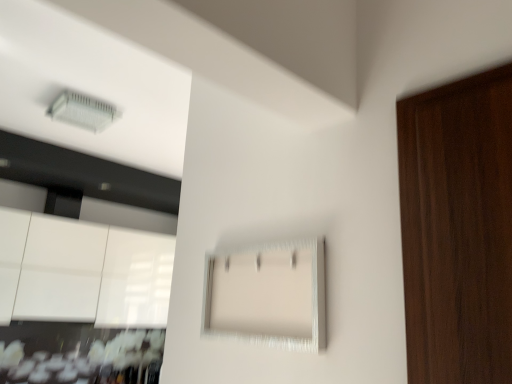
Describe the element at coordinates (268, 294) in the screenshot. I see `white textured cabinet at center, arranged as the second cabinetry when viewed from the left` at that location.

This screenshot has width=512, height=384. Identify the location of clear plastic air conditioning unit at upper left. (83, 111).

Considering the relative positions of clear plastic air conditioning unit at upper left and glossy white cabinetry at lower left, the 1th cabinetry in the left-to-right sequence, in the image provided, is clear plastic air conditioning unit at upper left to the left of glossy white cabinetry at lower left, the 1th cabinetry in the left-to-right sequence, from the viewer's perspective?

No, clear plastic air conditioning unit at upper left is not to the left of glossy white cabinetry at lower left, the 1th cabinetry in the left-to-right sequence.

I want to click on cabinetry that is behind the clear plastic air conditioning unit at upper left, so click(82, 272).

From a real-world perspective, which is physically below, clear plastic air conditioning unit at upper left or glossy white cabinetry at lower left, marked as the 2th cabinetry in a front-to-back arrangement?

In real-world perspective, glossy white cabinetry at lower left, marked as the 2th cabinetry in a front-to-back arrangement, is lower.

Considering the sizes of objects clear plastic air conditioning unit at upper left and glossy white cabinetry at lower left, marked as the 2th cabinetry in a front-to-back arrangement, in the image provided, who is taller, clear plastic air conditioning unit at upper left or glossy white cabinetry at lower left, marked as the 2th cabinetry in a front-to-back arrangement,?

glossy white cabinetry at lower left, marked as the 2th cabinetry in a front-to-back arrangement, is taller.

Who is smaller, glossy white cabinetry at lower left, the 1th cabinetry in the left-to-right sequence, or clear plastic air conditioning unit at upper left?

With smaller size is clear plastic air conditioning unit at upper left.

From a real-world perspective, which cabinetry is the 1st one underneath the clear plastic air conditioning unit at upper left? Please provide its 2D coordinates.

[(82, 272)]

From the image's perspective, would you say glossy white cabinetry at lower left, marked as the 2th cabinetry in a front-to-back arrangement, is shown under clear plastic air conditioning unit at upper left?

Indeed, from the image's perspective, glossy white cabinetry at lower left, marked as the 2th cabinetry in a front-to-back arrangement, is shown beneath clear plastic air conditioning unit at upper left.

Does point (132, 284) come farther from viewer compared to point (113, 111)?

Yes, it is.

From a real-world perspective, is glossy white cabinetry at lower left, the 1th cabinetry in the left-to-right sequence, physically located above or below white textured cabinet at center, arranged as the second cabinetry when viewed from the left?

glossy white cabinetry at lower left, the 1th cabinetry in the left-to-right sequence, is above white textured cabinet at center, arranged as the second cabinetry when viewed from the left.

What's the angular difference between glossy white cabinetry at lower left, marked as the 2th cabinetry in a front-to-back arrangement, and white textured cabinet at center, positioned as the 2th cabinetry in back-to-front order,'s facing directions?

The angular difference between glossy white cabinetry at lower left, marked as the 2th cabinetry in a front-to-back arrangement, and white textured cabinet at center, positioned as the 2th cabinetry in back-to-front order, is 90.2 degrees.

Is glossy white cabinetry at lower left, the 1th cabinetry when ordered from back to front, outside of white textured cabinet at center, which is the first cabinetry in right-to-left order?

glossy white cabinetry at lower left, the 1th cabinetry when ordered from back to front, is positioned outside white textured cabinet at center, which is the first cabinetry in right-to-left order.

Between glossy white cabinetry at lower left, the 1th cabinetry when ordered from back to front, and white textured cabinet at center, which is the first cabinetry in right-to-left order, which one is positioned behind?

glossy white cabinetry at lower left, the 1th cabinetry when ordered from back to front, is behind.

Is clear plastic air conditioning unit at upper left wider than white textured cabinet at center, arranged as the second cabinetry when viewed from the left?

Indeed, clear plastic air conditioning unit at upper left has a greater width compared to white textured cabinet at center, arranged as the second cabinetry when viewed from the left.

From the image's perspective, relative to white textured cabinet at center, arranged as the second cabinetry when viewed from the left, is clear plastic air conditioning unit at upper left above or below?

Clearly, from the image's perspective, clear plastic air conditioning unit at upper left is above white textured cabinet at center, arranged as the second cabinetry when viewed from the left.

Considering the positions of points (60, 94) and (256, 302), is point (60, 94) farther from camera compared to point (256, 302)?

That is True.

From the picture: Can you confirm if white textured cabinet at center, placed as the first cabinetry when sorted from front to back, is positioned to the right of glossy white cabinetry at lower left, marked as the 2th cabinetry in a front-to-back arrangement?

Yes.

In the scene shown: Is white textured cabinet at center, arranged as the second cabinetry when viewed from the left, facing away from glossy white cabinetry at lower left, which is the second cabinetry in right-to-left order?

No, glossy white cabinetry at lower left, which is the second cabinetry in right-to-left order, is not at the back of white textured cabinet at center, arranged as the second cabinetry when viewed from the left.

Does point (315, 301) lie behind point (86, 273)?

No.

Identify the location of cabinetry behind the white textured cabinet at center, positioned as the 2th cabinetry in back-to-front order. This screenshot has height=384, width=512. (82, 272).

Does white textured cabinet at center, positioned as the 2th cabinetry in back-to-front order, have a greater width compared to clear plastic air conditioning unit at upper left?

No.

Identify the location of cabinetry that is the 2nd object directly below the clear plastic air conditioning unit at upper left (from a real-world perspective). (268, 294).

Is white textured cabinet at center, positioned as the 2th cabinetry in back-to-front order, looking in the opposite direction of clear plastic air conditioning unit at upper left?

That's not correct — white textured cabinet at center, positioned as the 2th cabinetry in back-to-front order, is not looking away from clear plastic air conditioning unit at upper left.

From the picture: Is white textured cabinet at center, placed as the first cabinetry when sorted from front to back, further to camera compared to clear plastic air conditioning unit at upper left?

No, white textured cabinet at center, placed as the first cabinetry when sorted from front to back, is closer to the camera.

Image resolution: width=512 pixels, height=384 pixels. I want to click on cabinetry on the left of the clear plastic air conditioning unit at upper left, so click(82, 272).

The height and width of the screenshot is (384, 512). I want to click on air conditioning on the right of glossy white cabinetry at lower left, the 1th cabinetry in the left-to-right sequence, so click(x=83, y=111).

When comparing their distances from white textured cabinet at center, placed as the first cabinetry when sorted from front to back, does glossy white cabinetry at lower left, which is the second cabinetry in right-to-left order, or clear plastic air conditioning unit at upper left seem further?

glossy white cabinetry at lower left, which is the second cabinetry in right-to-left order.

Looking at the image, which one is located closer to clear plastic air conditioning unit at upper left, white textured cabinet at center, which is the first cabinetry in right-to-left order, or glossy white cabinetry at lower left, which is the second cabinetry in right-to-left order?

glossy white cabinetry at lower left, which is the second cabinetry in right-to-left order, lies closer to clear plastic air conditioning unit at upper left than the other object.

Considering their positions, is clear plastic air conditioning unit at upper left positioned closer to white textured cabinet at center, placed as the first cabinetry when sorted from front to back, than glossy white cabinetry at lower left, which is the second cabinetry in right-to-left order?

clear plastic air conditioning unit at upper left is positioned closer to the anchor white textured cabinet at center, placed as the first cabinetry when sorted from front to back.

Based on the photo, looking at the image, which one is located closer to glossy white cabinetry at lower left, the 1th cabinetry when ordered from back to front, white textured cabinet at center, positioned as the 2th cabinetry in back-to-front order, or clear plastic air conditioning unit at upper left?

clear plastic air conditioning unit at upper left is closer to glossy white cabinetry at lower left, the 1th cabinetry when ordered from back to front.

Looking at the image, which one is located closer to clear plastic air conditioning unit at upper left, glossy white cabinetry at lower left, the 1th cabinetry when ordered from back to front, or white textured cabinet at center, arranged as the second cabinetry when viewed from the left?

glossy white cabinetry at lower left, the 1th cabinetry when ordered from back to front, is positioned closer to the anchor clear plastic air conditioning unit at upper left.

Which object lies further to the anchor point glossy white cabinetry at lower left, the 1th cabinetry in the left-to-right sequence, clear plastic air conditioning unit at upper left or white textured cabinet at center, placed as the first cabinetry when sorted from front to back?

white textured cabinet at center, placed as the first cabinetry when sorted from front to back, lies further to glossy white cabinetry at lower left, the 1th cabinetry in the left-to-right sequence, than the other object.

You are a GUI agent. You are given a task and a screenshot of the screen. Output one action in this format:
    pyautogui.click(x=<x>, y=<y>)
    Task: Click on the air conditioning between white textured cabinet at center, which is the first cabinetry in right-to-left order, and glossy white cabinetry at lower left, the 1th cabinetry when ordered from back to front, in the front-back direction
    The image size is (512, 384).
    Given the screenshot: What is the action you would take?
    pyautogui.click(x=83, y=111)